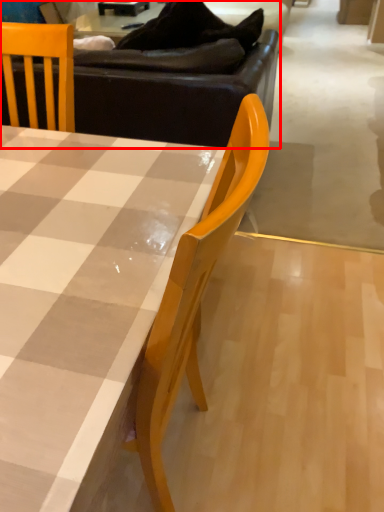
Question: From the image's perspective, considering the relative positions of studio couch (annotated by the red box) and table in the image provided, where is studio couch (annotated by the red box) located with respect to the staircase?

Choices:
 (A) below
 (B) above

Answer: (B)